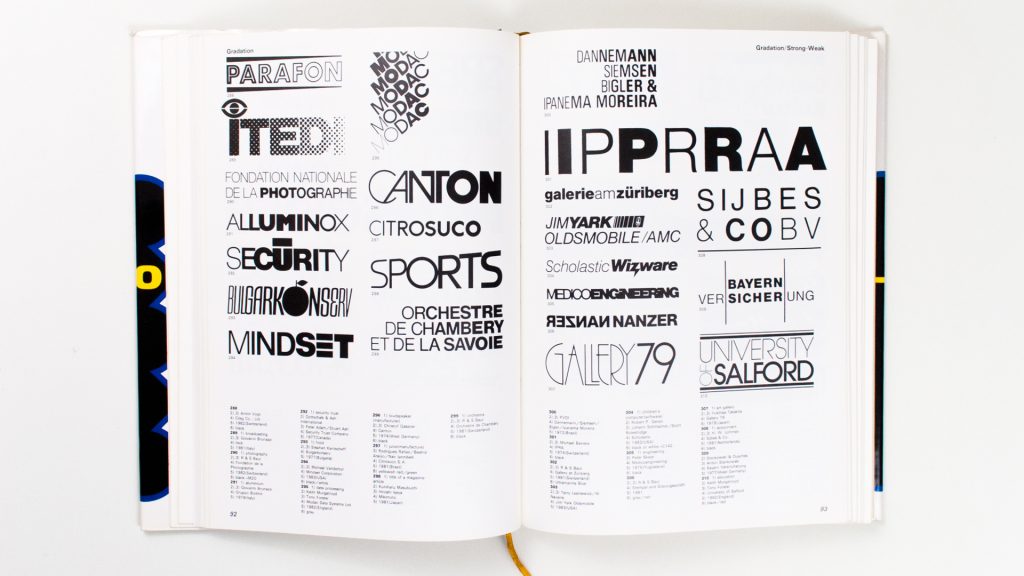
The width and height of the screenshot is (1024, 576). Find the location of `book`. book is located at coordinates (354, 378), (636, 372).